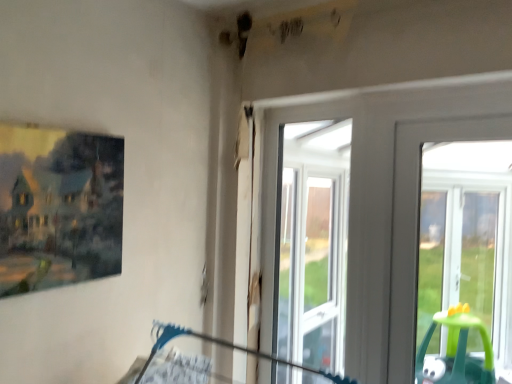
Question: Considering the positions of matte wooden picture frame at left and clear glass window at center in the image, is matte wooden picture frame at left wider or thinner than clear glass window at center?

Choices:
 (A) wide
 (B) thin

Answer: (A)

Question: From the image's perspective, is matte wooden picture frame at left positioned above or below clear glass window at center?

Choices:
 (A) below
 (B) above

Answer: (B)

Question: Considering the positions of matte wooden picture frame at left and clear glass window at center in the image, is matte wooden picture frame at left bigger or smaller than clear glass window at center?

Choices:
 (A) big
 (B) small

Answer: (B)

Question: Would you say clear glass window at center is to the left or to the right of matte wooden picture frame at left in the picture?

Choices:
 (A) left
 (B) right

Answer: (B)

Question: Relative to matte wooden picture frame at left, is clear glass window at center in front or behind?

Choices:
 (A) behind
 (B) front

Answer: (A)

Question: Is point (286, 188) positioned closer to the camera than point (64, 190)?

Choices:
 (A) farther
 (B) closer

Answer: (A)

Question: From their relative heights in the image, would you say clear glass window at center is taller or shorter than matte wooden picture frame at left?

Choices:
 (A) tall
 (B) short

Answer: (A)